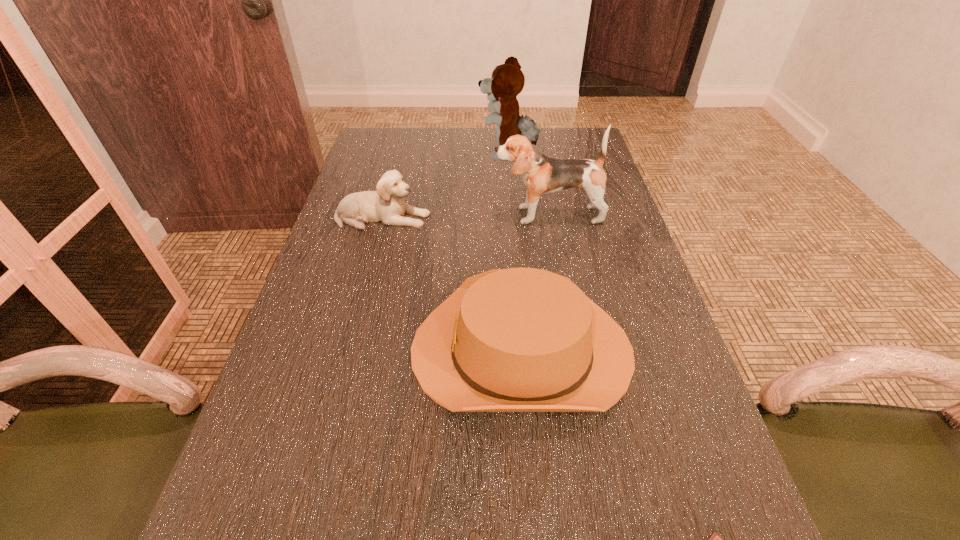
Identify the location of object at the far edge. (507, 80).

Locate an element on the screen. The width and height of the screenshot is (960, 540). object situated at the left edge is located at coordinates [x=387, y=205].

Image resolution: width=960 pixels, height=540 pixels. In order to click on puppy that is at the right edge in this screenshot , I will do `click(542, 175)`.

Image resolution: width=960 pixels, height=540 pixels. Identify the location of cowboy hat located in the right edge section of the desktop. (520, 339).

Where is `vacant space at the left edge of the desktop`? Image resolution: width=960 pixels, height=540 pixels. vacant space at the left edge of the desktop is located at coordinates (306, 535).

Where is `vacant space at the right edge`? Image resolution: width=960 pixels, height=540 pixels. vacant space at the right edge is located at coordinates (621, 295).

Image resolution: width=960 pixels, height=540 pixels. Find the location of `free space at the far left corner`. free space at the far left corner is located at coordinates tap(375, 140).

Locate an element on the screen. The height and width of the screenshot is (540, 960). free space between the shortest puppy and the farthest object is located at coordinates (445, 186).

Where is `vacant region between the shortest puppy and the farthest object`? vacant region between the shortest puppy and the farthest object is located at coordinates (445, 186).

This screenshot has width=960, height=540. I want to click on vacant region between the cowboy hat and the farthest object, so click(x=515, y=253).